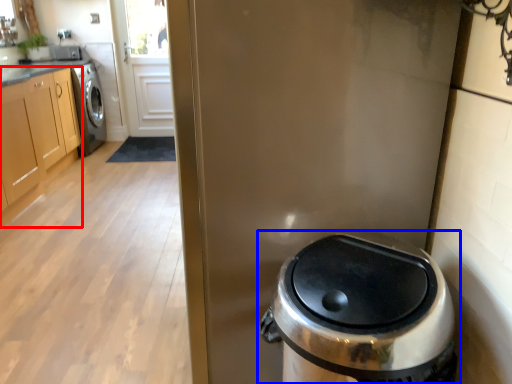
Question: Which object appears farthest to the camera in this image, cabinetry (highlighted by a red box) or waste container (highlighted by a blue box)?

Choices:
 (A) cabinetry
 (B) waste container

Answer: (A)